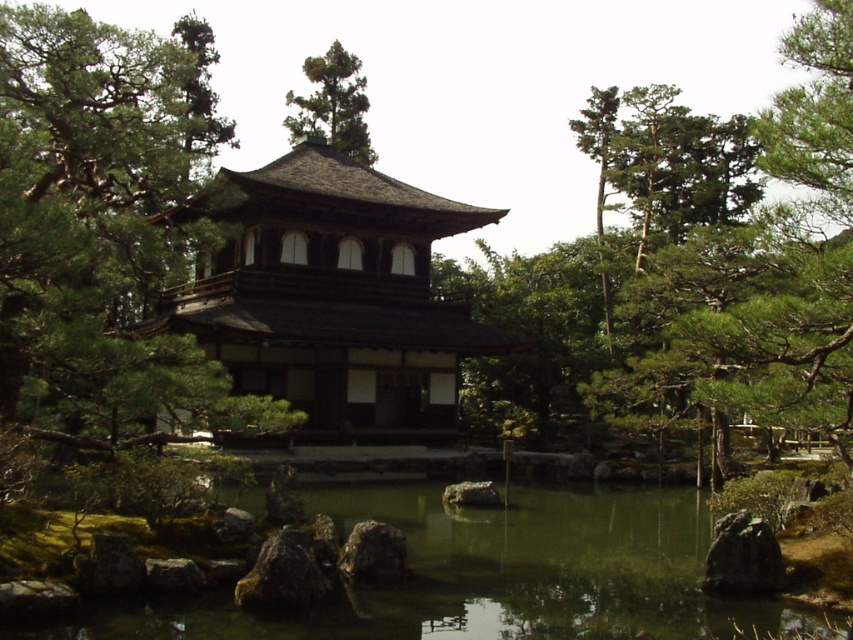
From the picture: You are a visitor in the Japanese garden and want to take a photo of the dark brown wooden temple at center and the smooth gray rock at center. Which object should you focus on first if you want to include both in your photo without moving the camera?

The dark brown wooden temple at center is larger than the smooth gray rock at center, so you should focus on the dark brown wooden temple at center first to ensure it fits properly in the frame.

You are a visitor in the Japanese garden and want to take a photo of the dark brown wooden temple at center. The garden has a path that goes straight from your current position. Will the temple be fully visible in the photo if you take it from this path without moving sideways?

The dark brown wooden temple at center is located at point [334,296], so yes, it will be fully visible in the photo as long as the path is aligned with the temple.